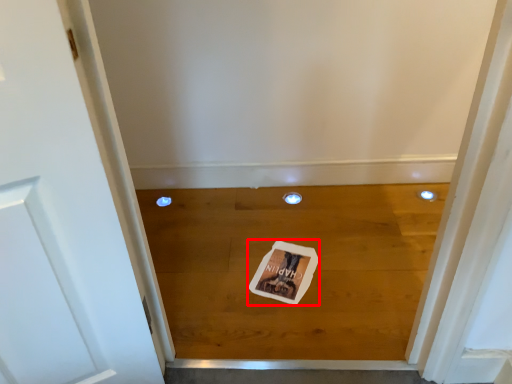
Question: Observing the image, what is the correct spatial positioning of postcard (annotated by the red box) in reference to plank?

Choices:
 (A) right
 (B) left

Answer: (B)